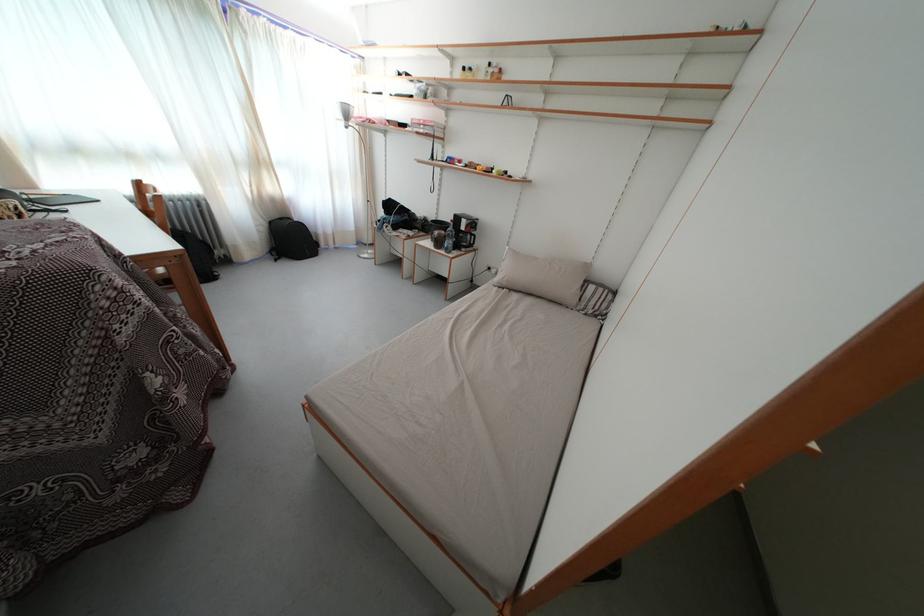
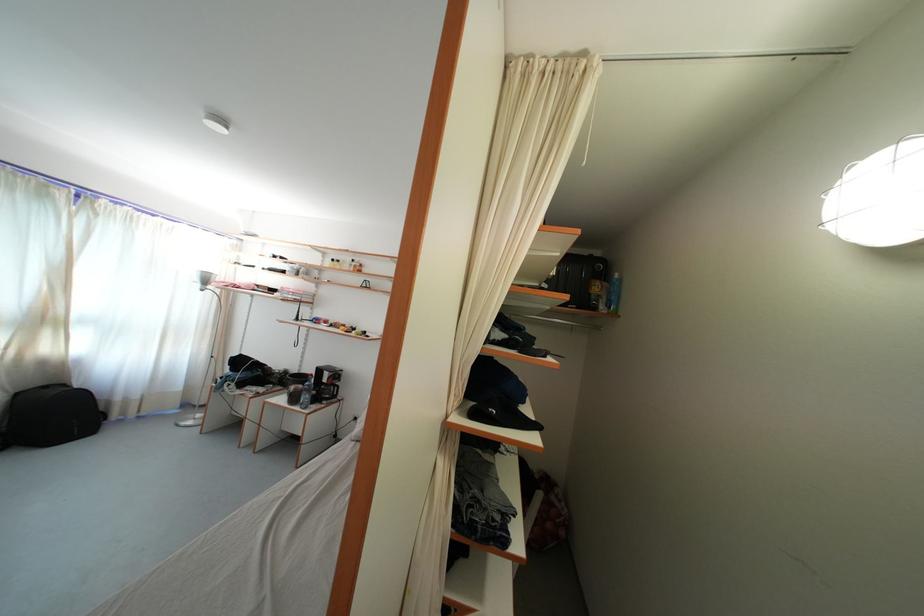
Locate, in the second image, the point that corresponds to (x=444, y=249) in the first image.

(300, 405)